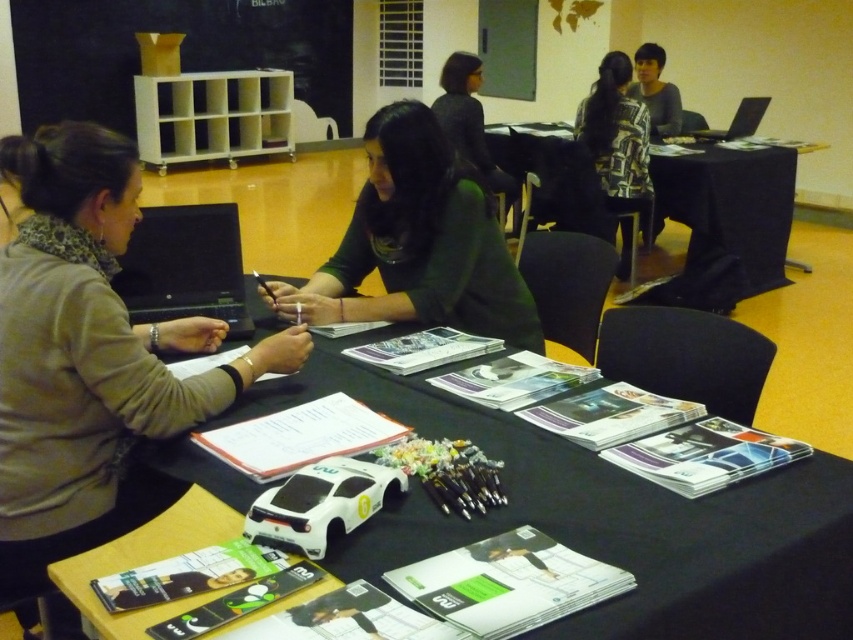
Who is higher up, black fabric table at upper right or black plastic laptop at upper right?

black plastic laptop at upper right

Does point (697, 221) come closer to viewer compared to point (753, 115)?

Yes, point (697, 221) is in front of point (753, 115).

Where is `black fabric table at upper right`? The height and width of the screenshot is (640, 853). black fabric table at upper right is located at coordinates pyautogui.click(x=726, y=221).

Is black fabric table at upper right to the right of black matte laptop at center from the viewer's perspective?

Indeed, black fabric table at upper right is positioned on the right side of black matte laptop at center.

Looking at this image, can you confirm if black fabric table at upper right is shorter than black matte laptop at center?

In fact, black fabric table at upper right may be taller than black matte laptop at center.

Find the location of a particular element. black fabric table at upper right is located at coordinates (726, 221).

Image resolution: width=853 pixels, height=640 pixels. I want to click on black fabric table at upper right, so pos(726,221).

Who is positioned more to the right, green matte shirt at center or black plastic laptop at upper right?

black plastic laptop at upper right

Is green matte shirt at center positioned before black plastic laptop at upper right?

Yes, green matte shirt at center is in front of black plastic laptop at upper right.

Which is behind, point (314, 292) or point (712, 140)?

Point (712, 140)

Identify the location of green matte shirt at center. This screenshot has height=640, width=853. (418, 243).